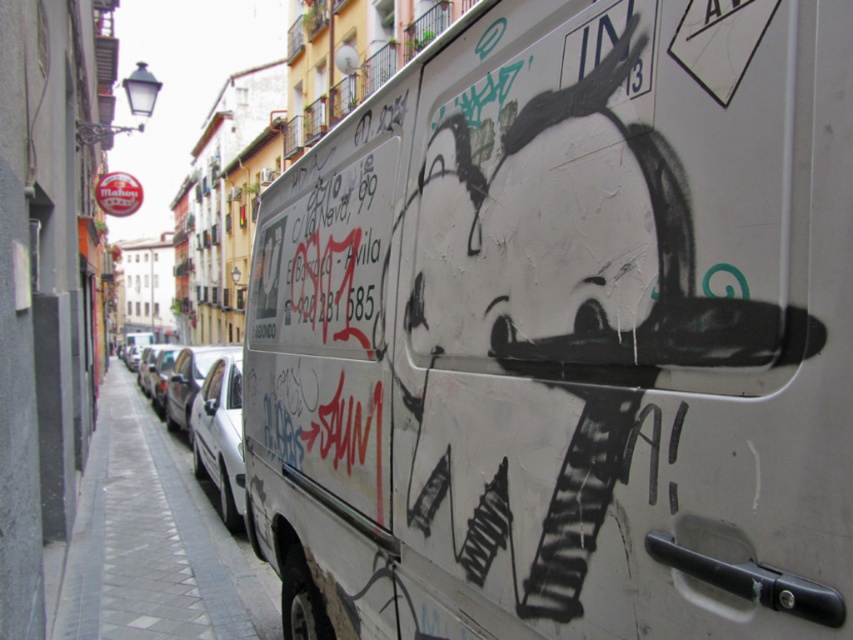
You are a delivery driver who needs to park your 4.5 meter long truck in this urban street. You see the white matte van at center and the gray tile pavement at lower left. Is there enough space between them to park your truck?

The distance between the white matte van at center and the gray tile pavement at lower left is 4.21 meters. Since your truck is 4.5 meters long, it is slightly longer than the available space. Therefore, there isn not enough space to park your truck between them.

You are standing on the sidewalk in the urban street scene and want to reach both the point at coordinates (692, 26) and the point at (224, 627). Which point is closer to you?

The point at coordinates (692, 26) is closer to you than the point at (224, 627).